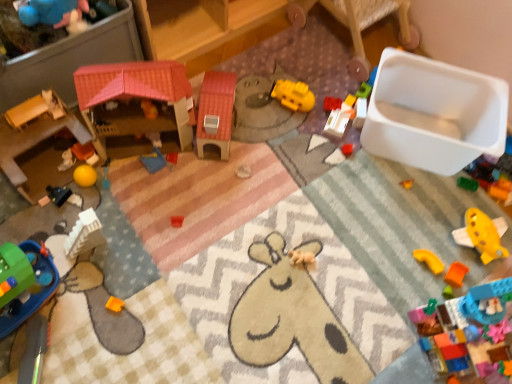
The height and width of the screenshot is (384, 512). Find the location of `free space between yellow plastic airplane at lower right, which appears as the first toy when viewed from the right, and black plastic toy at lower left, the 13th toy from the right`. free space between yellow plastic airplane at lower right, which appears as the first toy when viewed from the right, and black plastic toy at lower left, the 13th toy from the right is located at coordinates (293, 225).